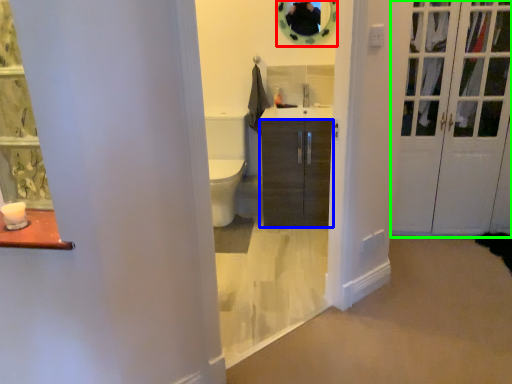
Question: Estimate the real-world distances between objects in this image. Which object is closer to mirror (highlighted by a red box), cabinetry (highlighted by a blue box) or door (highlighted by a green box)?

Choices:
 (A) cabinetry
 (B) door

Answer: (A)